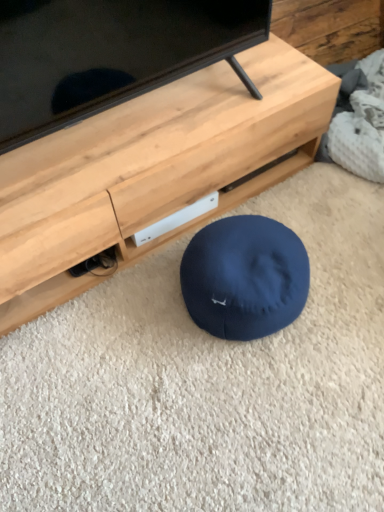
You are a GUI agent. You are given a task and a screenshot of the screen. Output one action in this format:
    pyautogui.click(x=<x>, y=<y>)
    Task: Click on the free space above matte wood tv stand at center (from a real-world perspective)
    The image size is (384, 512).
    Given the screenshot: What is the action you would take?
    pyautogui.click(x=128, y=131)